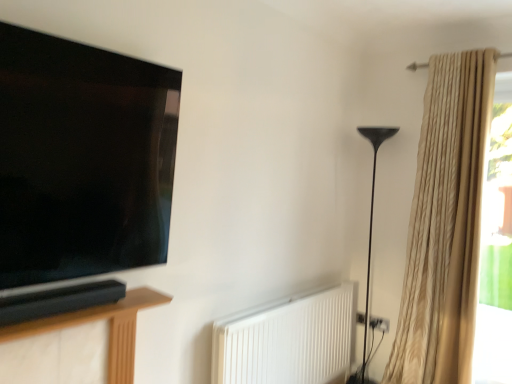
Question: Is black metal floor lamp at right bigger or smaller than matte black tv at left?

Choices:
 (A) big
 (B) small

Answer: (A)

Question: From the image's perspective, relative to matte black tv at left, is black metal floor lamp at right above or below?

Choices:
 (A) above
 (B) below

Answer: (B)

Question: Which is nearer to the white matte radiator at lower center?

Choices:
 (A) translucent glass window at right
 (B) brown wood soundbar at lower left
 (C) beige textured curtain at right
 (D) black metal floor lamp at right
 (E) matte black tv at left

Answer: (C)

Question: Based on their relative distances, which object is farther from the matte black tv at left?

Choices:
 (A) brown wood soundbar at lower left
 (B) black metal floor lamp at right
 (C) translucent glass window at right
 (D) white matte radiator at lower center
 (E) beige textured curtain at right

Answer: (C)